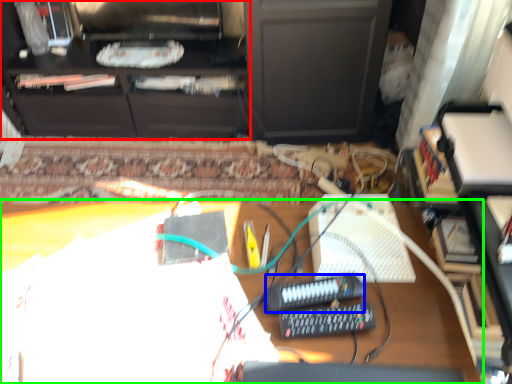
Question: Which object is the farthest from furniture (highlighted by a red box)? Choose among these: equipment (highlighted by a blue box) or desk (highlighted by a green box).

Choices:
 (A) equipment
 (B) desk

Answer: (A)